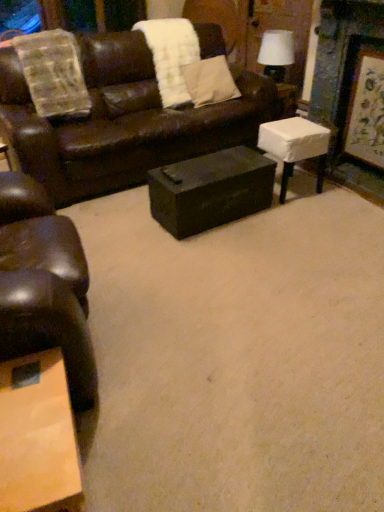
Locate an element on the screen. free location to the right of white fabric-covered stool at right, the second table in the left-to-right sequence is located at coordinates (332, 193).